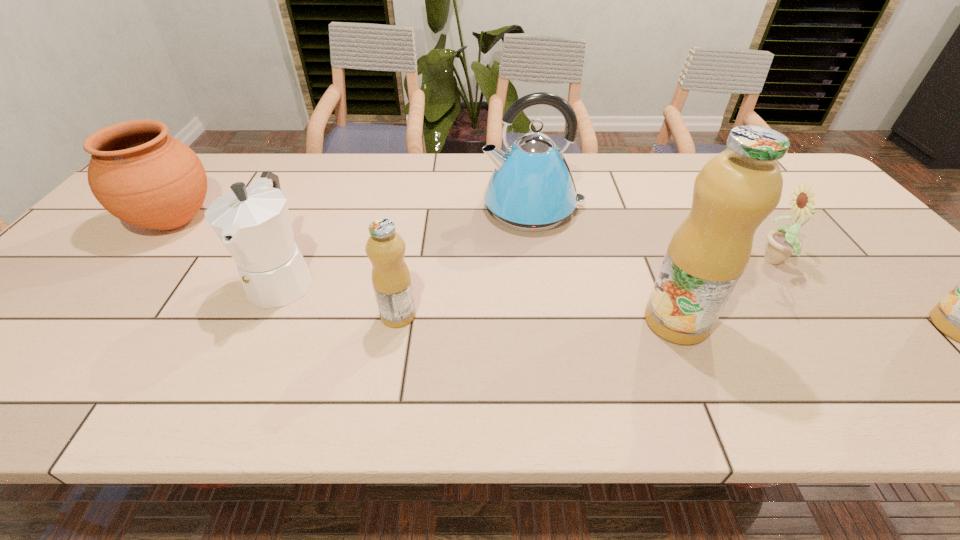
Where is `the shortest fruit juice`? This screenshot has width=960, height=540. the shortest fruit juice is located at coordinates (385, 248).

Where is `the leftmost fruit juice`? This screenshot has width=960, height=540. the leftmost fruit juice is located at coordinates point(385,248).

Image resolution: width=960 pixels, height=540 pixels. I want to click on the third object from right to left, so click(x=736, y=190).

Locate an element on the screen. The image size is (960, 540). kettle is located at coordinates (532, 189).

Where is `the second object from right to left`? the second object from right to left is located at coordinates coord(783,242).

Where is `the leftmost object`? This screenshot has width=960, height=540. the leftmost object is located at coordinates (143, 176).

Where is `the second object from left to right`? The image size is (960, 540). the second object from left to right is located at coordinates (253, 223).

Locate an element on the screen. The image size is (960, 540). vacant space situated on the front label of the shortest fruit juice is located at coordinates (287, 315).

Where is `vacant space situated on the front label of the shortest fruit juice`? vacant space situated on the front label of the shortest fruit juice is located at coordinates (300, 315).

You are a GUI agent. You are given a task and a screenshot of the screen. Output one action in this format:
    pyautogui.click(x=<x>, y=<y>)
    Task: Click on the free space located on the front label of the shortest fruit juice
    This screenshot has width=960, height=540.
    Given the screenshot: What is the action you would take?
    pyautogui.click(x=326, y=315)